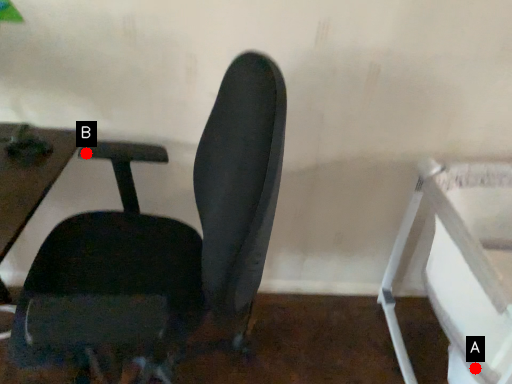
Question: Two points are circled on the image, labeled by A and B beside each circle. Which of the following is the closest to the observer?

Choices:
 (A) A is closer
 (B) B is closer

Answer: (A)